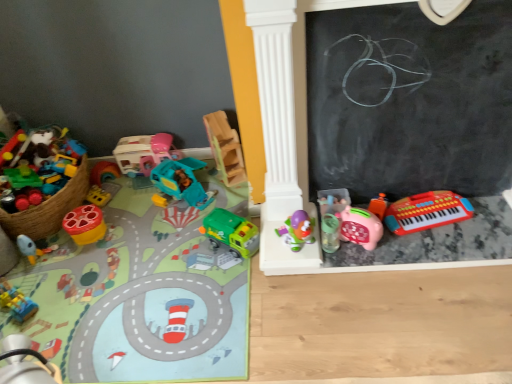
What are the coordinates of `vacant space to the right of shiny plastic toy at left, the tenth toy positioned from the right` in the screenshot? It's located at (129, 225).